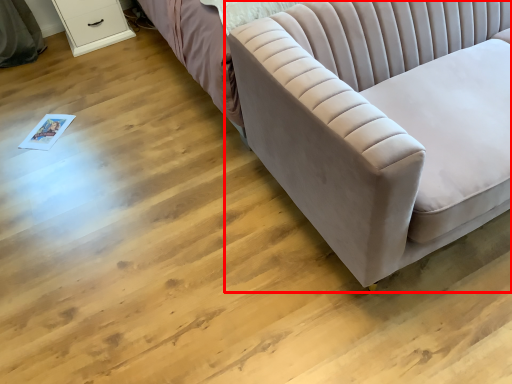
Question: Where is studio couch (annotated by the red box) located in relation to dresser in the image?

Choices:
 (A) right
 (B) left

Answer: (A)